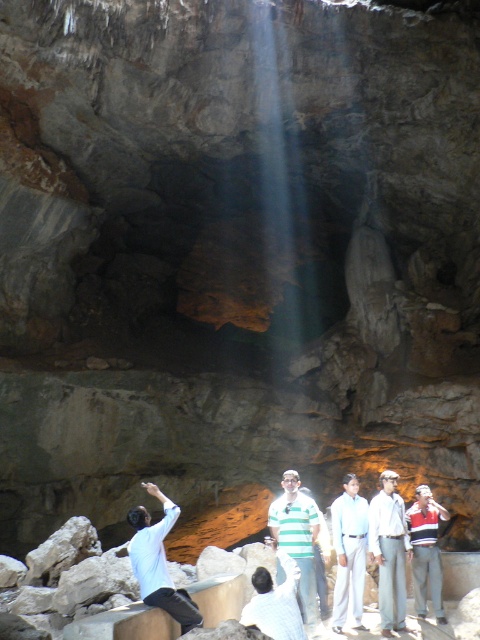
You are inside the cave and notice a white cotton shirt at center. Based on the coordinates provided in the Objects Description, can you determine if the shirt is positioned closer to the cave entrance or deeper inside?

The white cotton shirt at center is located at point (388, 552), which suggests it is positioned deeper inside the cave rather than near the entrance, as higher coordinate values typically indicate positions further from the entrance in such contexts.

You are standing in the cave and want to take a photo of the white cotton shirt at center. Your camera is 24.90 feet away from the shirt. Is the distance sufficient to capture the entire shirt in the photo?

The white cotton shirt at center and camera are 24.90 feet apart. The distance of 24.90 feet is sufficient to capture the entire shirt in the photo as long as the camera has a wide enough lens or zoom capability.